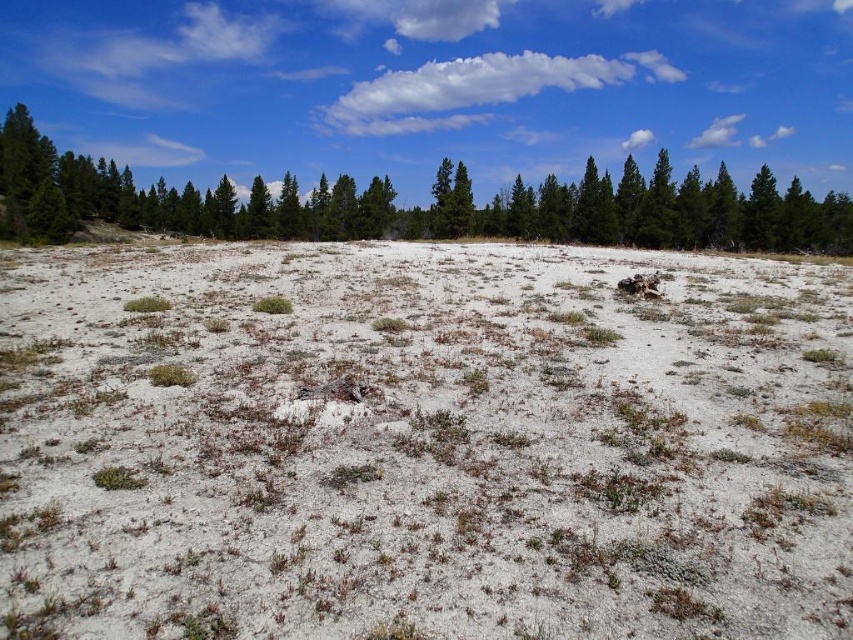
Between white sandy plain at center and green textured pine at upper center, which one appears on the left side from the viewer's perspective?

white sandy plain at center

Who is positioned more to the right, white sandy plain at center or green textured pine at upper center?

Positioned to the right is green textured pine at upper center.

Between point (680, 470) and point (230, 212), which one is positioned behind?

The point (230, 212) is behind.

This screenshot has height=640, width=853. I want to click on white sandy plain at center, so click(x=422, y=444).